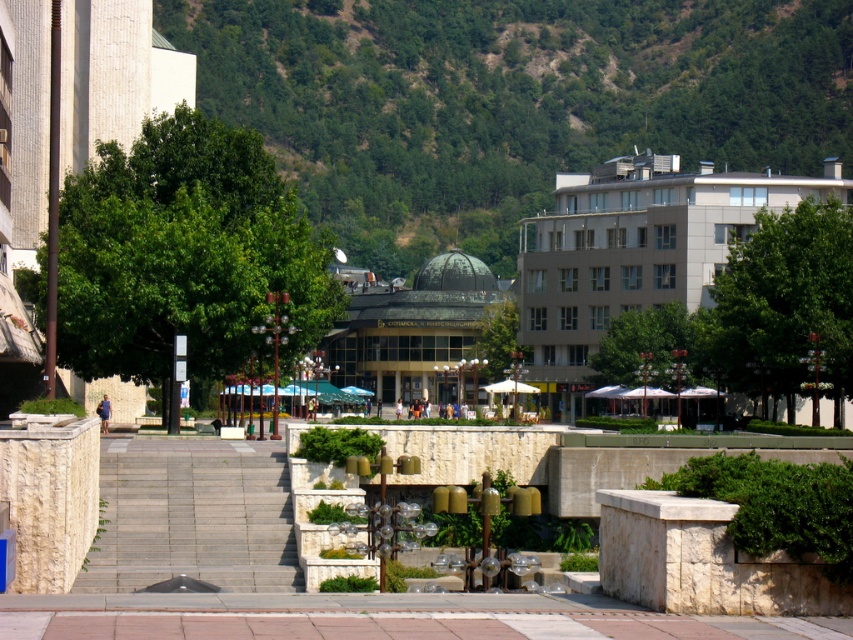
Question: Which point is farther to the camera?

Choices:
 (A) (643, 200)
 (B) (230, 58)
 (C) (248, 474)

Answer: (B)

Question: Which point is farther to the camera?

Choices:
 (A) gray stone stairs at center
 (B) beige concrete building at right
 (C) green glass dome at center

Answer: (C)

Question: Is green leafy hillside at upper center closer to camera compared to green glass dome at center?

Choices:
 (A) yes
 (B) no

Answer: (B)

Question: Does green leafy hillside at upper center have a larger size compared to beige concrete building at right?

Choices:
 (A) yes
 (B) no

Answer: (A)

Question: Is green leafy hillside at upper center further to camera compared to beige concrete building at right?

Choices:
 (A) yes
 (B) no

Answer: (A)

Question: Considering the real-world distances, which object is farthest from the green leafy hillside at upper center?

Choices:
 (A) beige concrete building at right
 (B) green glass dome at center

Answer: (B)